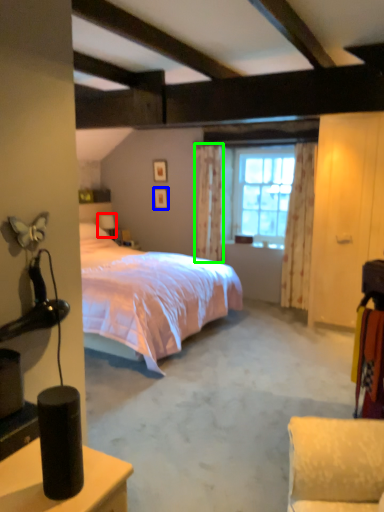
Question: Based on their relative distances, which object is nearer to table lamp (highlighted by a red box)? Choose from picture frame (highlighted by a blue box) and curtain (highlighted by a green box).

Choices:
 (A) picture frame
 (B) curtain

Answer: (A)